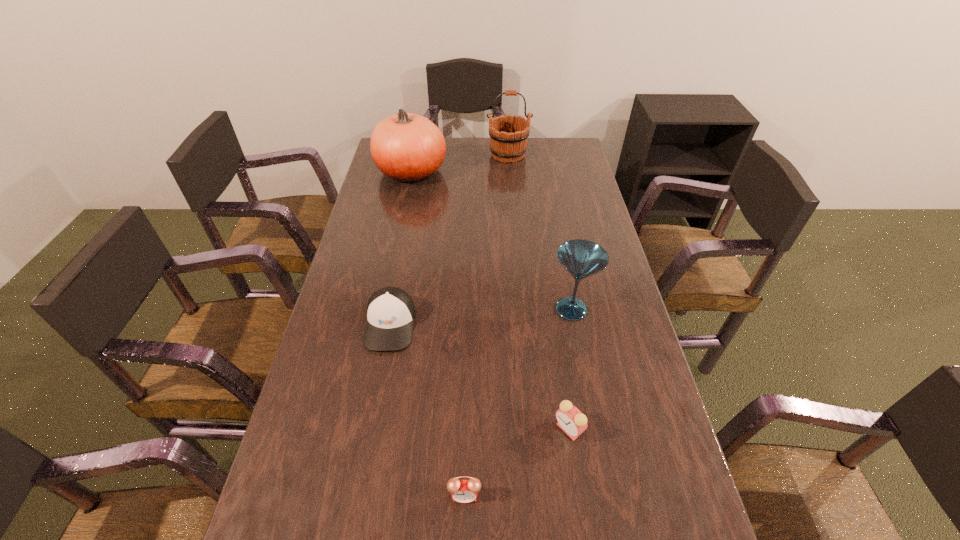
The height and width of the screenshot is (540, 960). What are the coordinates of `vacant area between the third tallest object and the fifth farthest object` in the screenshot? It's located at (570, 369).

Locate an element on the screen. unoccupied area between the wine bucket and the right alarm clock is located at coordinates (539, 292).

I want to click on empty location between the fourth shortest object and the right alarm clock, so click(x=570, y=369).

This screenshot has width=960, height=540. I want to click on empty space between the third tallest object and the wine bucket, so click(x=540, y=232).

Identify the location of object that is the fifth closest one to the pumpkin. This screenshot has width=960, height=540. (462, 491).

Where is `object that can be found as the third closest to the wine bucket`? object that can be found as the third closest to the wine bucket is located at coordinates (391, 312).

Identify the location of free space in the image that satisfies the following two spatial constraints: 1. on the face of the right alarm clock; 2. on the clock face of the left alarm clock. The height and width of the screenshot is (540, 960). (579, 496).